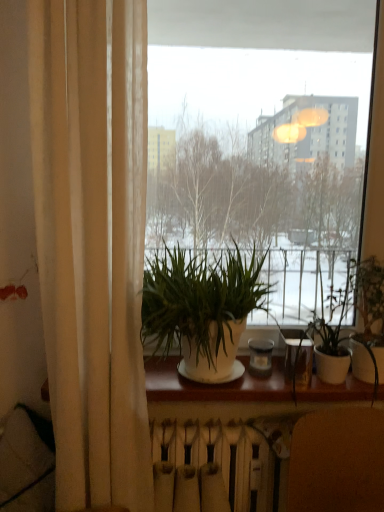
Question: Visually, is green leafy plant at center, which is the 2th houseplant in left-to-right order, positioned to the left or to the right of white matte wood at center?

Choices:
 (A) right
 (B) left

Answer: (A)

Question: From a real-world perspective, relative to white matte wood at center, is green leafy plant at center, which is the 2th houseplant in left-to-right order, vertically above or below?

Choices:
 (A) above
 (B) below

Answer: (A)

Question: Estimate the real-world distances between objects in this image. Which object is farther from the brown leather armchair at lower right?

Choices:
 (A) transparent glass window at center
 (B) white matte wood at center
 (C) white matte radiator at lower center
 (D) green leafy plant at center, the first houseplant viewed from the right
 (E) beige fabric curtain at left

Answer: (A)

Question: Considering the real-world distances, which object is farthest from the brown leather armchair at lower right?

Choices:
 (A) green leafy plant at center, the first houseplant viewed from the right
 (B) white matte wood at center
 (C) white matte radiator at lower center
 (D) transparent glass window at center
 (E) white matte plant pot at center, the 2th houseplant when ordered from right to left

Answer: (D)